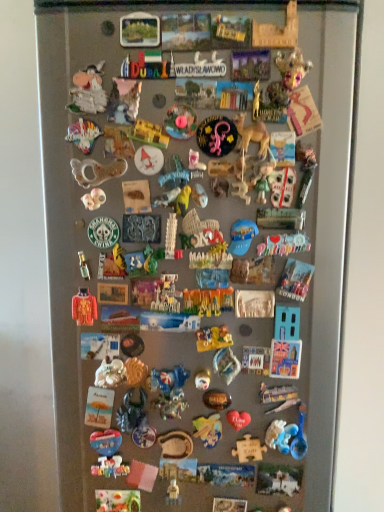
Locate an element on the screen. This screenshot has width=384, height=512. translucent plastic toy at center, the 30th toy from the top is located at coordinates (169, 391).

What is the approximate width of multicolored plastic toy at center, the 23th toy viewed from the top?

The width of multicolored plastic toy at center, the 23th toy viewed from the top, is 0.79 inches.

What do you see at coordinates (94, 199) in the screenshot?
I see `white matte toy at center-left, placed as the 25th toy when sorted from bottom to top` at bounding box center [94, 199].

At what (x,y) coordinates should I click in order to perform the action: click on white matte toy at center-left, placed as the 25th toy when sorted from bottom to top. Please return your answer as a coordinate pair (x, y). The image size is (384, 512). Looking at the image, I should click on (94, 199).

This screenshot has width=384, height=512. Find the location of `matte plastic toy at upper left, which appears as the 4th toy when viewed from the top`. matte plastic toy at upper left, which appears as the 4th toy when viewed from the top is located at coordinates (88, 91).

From the picture: Measure the distance between point (264, 178) and camera.

A distance of 30.91 inches exists between point (264, 178) and camera.

The height and width of the screenshot is (512, 384). Identify the location of translucent plastic toy at center, the 30th toy from the top. (169, 391).

From the image's perspective, who appears lower, translucent plastic baby rattle at center, which is the 12th toy in top-to-bottom order, or wooden puzzle piece at lower center, marked as the 38th toy in a top-to-bottom arrangement?

From the image's view, wooden puzzle piece at lower center, marked as the 38th toy in a top-to-bottom arrangement, is below.

From a real-world perspective, who is located higher, translucent plastic baby rattle at center, which is the 12th toy in top-to-bottom order, or wooden puzzle piece at lower center, positioned as the 2th toy in bottom-to-top order?

translucent plastic baby rattle at center, which is the 12th toy in top-to-bottom order.

Which object is more forward, translucent plastic baby rattle at center, positioned as the 28th toy in bottom-to-top order, or wooden puzzle piece at lower center, positioned as the 2th toy in bottom-to-top order?

translucent plastic baby rattle at center, positioned as the 28th toy in bottom-to-top order.

Does point (122, 161) lie in front of point (291, 485)?

Yes, it is in front of point (291, 485).

Which object is further away from the camera taking this photo, white plastic toy at upper right, arranged as the 14th toy when viewed from the top, or matte brown figurine at center, acting as the 27th toy starting from the top?

matte brown figurine at center, acting as the 27th toy starting from the top.

Which of these two, white plastic toy at upper right, arranged as the 26th toy when ordered from the bottom, or matte brown figurine at center, acting as the 27th toy starting from the top, stands shorter?

matte brown figurine at center, acting as the 27th toy starting from the top, is shorter.

Is matte yellow toy at center, which is counted as the 33th toy, starting from the bottom, at the back of wooden puzzle piece at lower center, positioned as the 2th toy in bottom-to-top order?

wooden puzzle piece at lower center, positioned as the 2th toy in bottom-to-top order, is not turned away from matte yellow toy at center, which is counted as the 33th toy, starting from the bottom.

Considering their positions, is wooden puzzle piece at lower center, positioned as the 2th toy in bottom-to-top order, located in front of or behind matte yellow toy at center, which is counted as the seventh toy, starting from the top?

Visually, wooden puzzle piece at lower center, positioned as the 2th toy in bottom-to-top order, is located behind matte yellow toy at center, which is counted as the seventh toy, starting from the top.

In terms of height, does wooden puzzle piece at lower center, positioned as the 2th toy in bottom-to-top order, look taller or shorter compared to matte yellow toy at center, which is counted as the 33th toy, starting from the bottom?

Considering their sizes, wooden puzzle piece at lower center, positioned as the 2th toy in bottom-to-top order, has more height than matte yellow toy at center, which is counted as the 33th toy, starting from the bottom.

Can you confirm if pink plastic lizard at center, which is the 30th toy from bottom to top, is smaller than matte blue heart at center, the 34th toy in the top-to-bottom sequence?

No.

From the image's perspective, who appears lower, pink plastic lizard at center, arranged as the tenth toy when viewed from the top, or matte blue heart at center, the 34th toy in the top-to-bottom sequence?

matte blue heart at center, the 34th toy in the top-to-bottom sequence.

Which object is positioned more to the left, pink plastic lizard at center, which is the 30th toy from bottom to top, or matte blue heart at center, acting as the sixth toy starting from the bottom?

matte blue heart at center, acting as the sixth toy starting from the bottom, is more to the left.

Is pink plastic lizard at center, arranged as the tenth toy when viewed from the top, positioned in front of matte blue heart at center, acting as the sixth toy starting from the bottom?

Yes, the depth of pink plastic lizard at center, arranged as the tenth toy when viewed from the top, is less than that of matte blue heart at center, acting as the sixth toy starting from the bottom.

Locate an element on the screen. The height and width of the screenshot is (512, 384). the 12th toy to the right of the matte plastic toy at center, the 20th toy from the top, counting from the anchor's position is located at coordinates (283, 244).

Does matte plastic toy at center, which appears as the 20th toy when ordered from the bottom, turn towards pastel plastic toy at center, which ranks as the 18th toy in top-to-bottom order?

Yes, matte plastic toy at center, which appears as the 20th toy when ordered from the bottom, is facing pastel plastic toy at center, which ranks as the 18th toy in top-to-bottom order.

Is the depth of matte plastic toy at center, which appears as the 20th toy when ordered from the bottom, less than that of pastel plastic toy at center, positioned as the 22th toy in bottom-to-top order?

Yes, the depth of matte plastic toy at center, which appears as the 20th toy when ordered from the bottom, is less than that of pastel plastic toy at center, positioned as the 22th toy in bottom-to-top order.

Would you say matte plastic toy at center, which appears as the 20th toy when ordered from the bottom, is a long distance from pastel plastic toy at center, which ranks as the 18th toy in top-to-bottom order?

No, matte plastic toy at center, which appears as the 20th toy when ordered from the bottom, is not far from pastel plastic toy at center, which ranks as the 18th toy in top-to-bottom order.

Can you confirm if blue plastic toy at center, arranged as the 33th toy when viewed from the top, is positioned to the left of orange fabric sweater at lower left, arranged as the 24th toy when viewed from the top?

In fact, blue plastic toy at center, arranged as the 33th toy when viewed from the top, is to the right of orange fabric sweater at lower left, arranged as the 24th toy when viewed from the top.

Can orange fabric sweater at lower left, arranged as the 24th toy when viewed from the top, be found inside blue plastic toy at center, which ranks as the seventh toy in bottom-to-top order?

That's incorrect, orange fabric sweater at lower left, arranged as the 24th toy when viewed from the top, is not inside blue plastic toy at center, which ranks as the seventh toy in bottom-to-top order.

Who is more distant, blue plastic toy at center, arranged as the 33th toy when viewed from the top, or orange fabric sweater at lower left, placed as the sixteenth toy when sorted from bottom to top?

blue plastic toy at center, arranged as the 33th toy when viewed from the top, is behind.

What's the angular difference between matte plastic magnet at center-right, which is counted as the 21th toy, starting from the top, and multicolored plastic toy at center, the 3th toy positioned from the bottom,'s facing directions?

0.00113 degrees separate the facing orientations of matte plastic magnet at center-right, which is counted as the 21th toy, starting from the top, and multicolored plastic toy at center, the 3th toy positioned from the bottom.

Where is `the 16th toy positioned below the matte plastic magnet at center-right, the 19th toy in the bottom-to-top sequence (from a real-world perspective)`? Image resolution: width=384 pixels, height=512 pixels. the 16th toy positioned below the matte plastic magnet at center-right, the 19th toy in the bottom-to-top sequence (from a real-world perspective) is located at coordinates (110, 467).

Relative to multicolored plastic toy at center, the 37th toy in the top-to-bottom sequence, is matte plastic magnet at center-right, the 19th toy in the bottom-to-top sequence, in front or behind?

matte plastic magnet at center-right, the 19th toy in the bottom-to-top sequence, is in front of multicolored plastic toy at center, the 37th toy in the top-to-bottom sequence.

Looking at their sizes, would you say matte plastic magnet at center-right, the 19th toy in the bottom-to-top sequence, is wider or thinner than multicolored plastic toy at center, the 3th toy positioned from the bottom?

matte plastic magnet at center-right, the 19th toy in the bottom-to-top sequence, is thinner than multicolored plastic toy at center, the 3th toy positioned from the bottom.

I want to click on the 26th toy positioned above the wooden puzzle piece at lower center, marked as the 38th toy in a top-to-bottom arrangement (from a real-world perspective), so click(x=96, y=170).

Where is `toy that is the 13th one when counting upward from the matte brown figurine at center, acting as the 27th toy starting from the top (from the image's perspective)`? The height and width of the screenshot is (512, 384). toy that is the 13th one when counting upward from the matte brown figurine at center, acting as the 27th toy starting from the top (from the image's perspective) is located at coordinates (282, 186).

Based on their spatial positions, is matte yellow toy at center, which is counted as the seventh toy, starting from the top, or blue plastic toy at center, which ranks as the seventh toy in bottom-to-top order, further from metallic silver puzzle piece at center, the 12th toy from the bottom?

Based on the image, matte yellow toy at center, which is counted as the seventh toy, starting from the top, appears to be further to metallic silver puzzle piece at center, the 12th toy from the bottom.

Looking at the image, which one is located further to translucent plastic baby rattle at center, which is the 12th toy in top-to-bottom order, multicolored plastic toy at center, the 37th toy in the top-to-bottom sequence, or pink plastic lizard at center, arranged as the tenth toy when viewed from the top?

Based on the image, multicolored plastic toy at center, the 37th toy in the top-to-bottom sequence, appears to be further to translucent plastic baby rattle at center, which is the 12th toy in top-to-bottom order.

From the image, which object appears to be farther from matte plastic toy at center, the 14th toy ordered from the bottom, pink plastic toy at center, which is the 6th toy in top-to-bottom order, or white plastic toy at upper right, arranged as the 14th toy when viewed from the top?

pink plastic toy at center, which is the 6th toy in top-to-bottom order, lies further to matte plastic toy at center, the 14th toy ordered from the bottom, than the other object.

Estimate the real-world distances between objects in this image. Which object is further from wooden puzzle piece at lower center, positioned as the 2th toy in bottom-to-top order, translucent plastic toy at center, which is counted as the 39th toy, starting from the top, or multicolored plastic toy at center, arranged as the 22th toy when viewed from the top?

multicolored plastic toy at center, arranged as the 22th toy when viewed from the top, is positioned further to the anchor wooden puzzle piece at lower center, positioned as the 2th toy in bottom-to-top order.

Estimate the real-world distances between objects in this image. Which object is closer to white matte toy at center-left, placed as the 25th toy when sorted from bottom to top, metallic silver frame at upper center, which is the 39th toy in bottom-to-top order, or matte plastic toy at center, the 20th toy from the top?

metallic silver frame at upper center, which is the 39th toy in bottom-to-top order, lies closer to white matte toy at center-left, placed as the 25th toy when sorted from bottom to top, than the other object.

Looking at this image, looking at the image, which one is located further to wooden puzzle piece at lower center, marked as the 38th toy in a top-to-bottom arrangement, metallic silver puzzle piece at center, which is the 28th toy from top to bottom, or brown leather belt at center, which ranks as the fifth toy in bottom-to-top order?

Among the two, metallic silver puzzle piece at center, which is the 28th toy from top to bottom, is located further to wooden puzzle piece at lower center, marked as the 38th toy in a top-to-bottom arrangement.

Estimate the real-world distances between objects in this image. Which object is closer to shiny plastic crown at upper right, the 3th toy positioned from the top, metallic silver puzzle piece at center, which is the 28th toy from top to bottom, or matte brown figurine at center, positioned as the 31th toy in bottom-to-top order?

Among the two, matte brown figurine at center, positioned as the 31th toy in bottom-to-top order, is located nearer to shiny plastic crown at upper right, the 3th toy positioned from the top.

Which object lies nearer to the anchor point white plastic toy at upper right, arranged as the 26th toy when ordered from the bottom, translucent plastic baby rattle at center, which is the 12th toy in top-to-bottom order, or pastel plastic toy at center, which ranks as the 18th toy in top-to-bottom order?

Based on the image, pastel plastic toy at center, which ranks as the 18th toy in top-to-bottom order, appears to be nearer to white plastic toy at upper right, arranged as the 26th toy when ordered from the bottom.